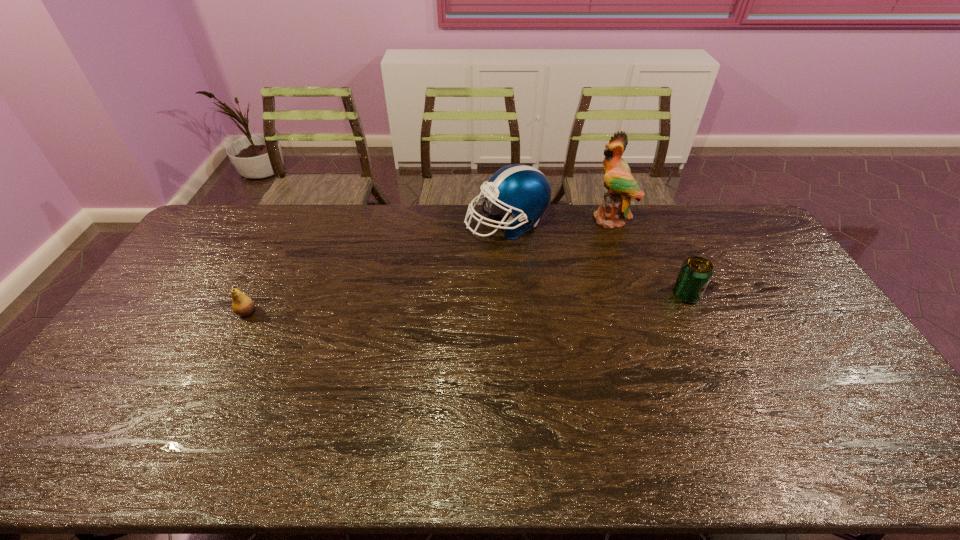
You are a GUI agent. You are given a task and a screenshot of the screen. Output one action in this format:
    pyautogui.click(x=<x>, y=<y>)
    Task: Click on the free spot on the desktop that is between the pear and the beer can and is positioned at the front of the football helmet with the faceguard
    Image resolution: width=960 pixels, height=540 pixels.
    Given the screenshot: What is the action you would take?
    pyautogui.click(x=452, y=304)

At what (x,y) coordinates should I click in order to perform the action: click on free space on the desktop that is between the pear and the rightmost object and is positioned on the front-facing side of the third object from left to right. Please return your answer as a coordinate pair (x, y). The width and height of the screenshot is (960, 540). Looking at the image, I should click on (523, 301).